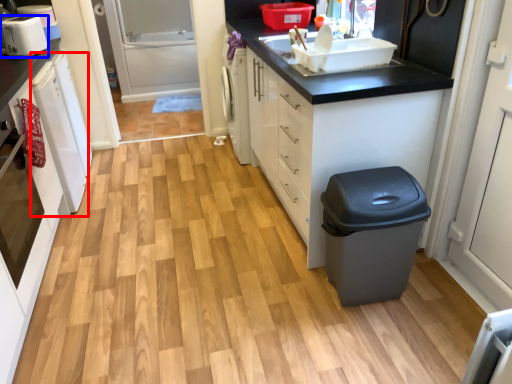
Question: Which point is further to the camera, dish washer (highlighted by a red box) or home appliance (highlighted by a blue box)?

Choices:
 (A) dish washer
 (B) home appliance

Answer: (B)